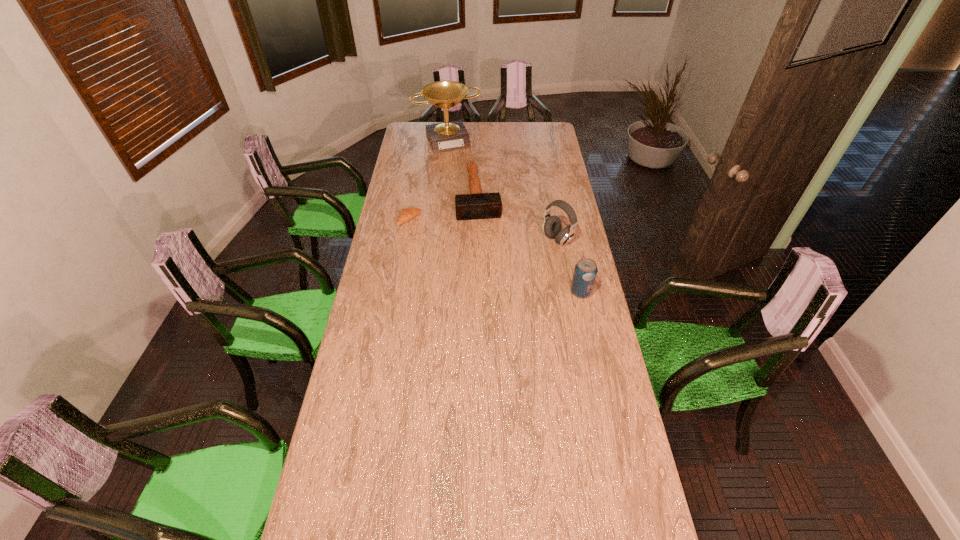
You are a GUI agent. You are given a task and a screenshot of the screen. Output one action in this format:
    pyautogui.click(x=<x>, y=<y>)
    Task: Click on the crescent roll
    The image size is (960, 540).
    Given the screenshot: What is the action you would take?
    [407, 214]

Identify the location of pop soda. (585, 271).

This screenshot has height=540, width=960. I want to click on the third shortest object, so click(x=585, y=271).

Identify the location of the fourth farthest object. (552, 225).

Identify the location of headset. The width and height of the screenshot is (960, 540). (552, 225).

This screenshot has width=960, height=540. Identify the location of the tallest object. (448, 136).

In order to click on award in this screenshot , I will do `click(448, 136)`.

The height and width of the screenshot is (540, 960). I want to click on mallet, so click(477, 205).

Locate an element on the screen. Image resolution: width=960 pixels, height=540 pixels. free space located on the right of the crescent roll is located at coordinates (439, 219).

Find the location of `vacant space located 0.170m on the left of the pop soda`. vacant space located 0.170m on the left of the pop soda is located at coordinates (528, 292).